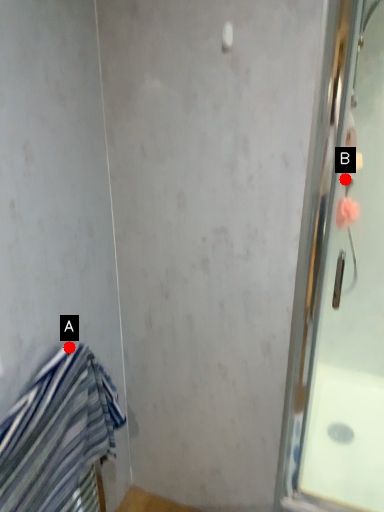
Question: Two points are circled on the image, labeled by A and B beside each circle. Which of the following is the closest to the observer?

Choices:
 (A) A is closer
 (B) B is closer

Answer: (A)